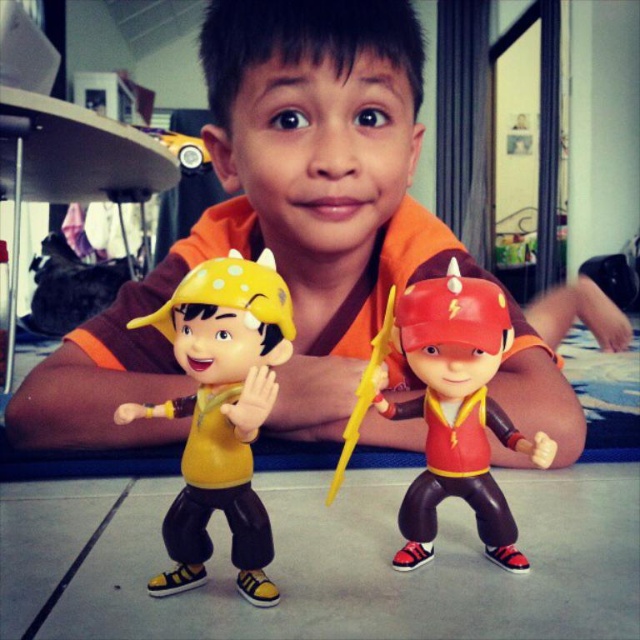
You are a delivery drone trying to land at point (195, 451). The minimum safe distance for landing is 20 inches. Can you land safely?

The distance of point (195, 451) from viewer is 22.00 inches, so yes, the drone can land safely as it meets the minimum safe distance requirement.